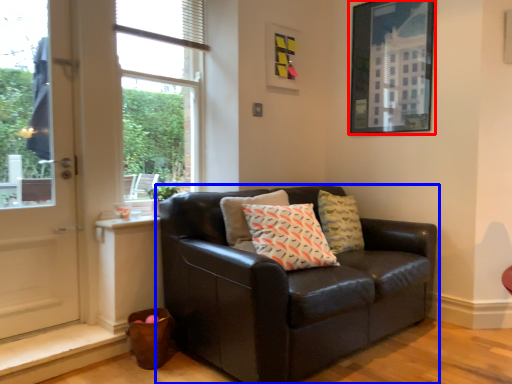
Question: Which object appears closest to the camera in this image, picture frame (highlighted by a red box) or studio couch (highlighted by a blue box)?

Choices:
 (A) picture frame
 (B) studio couch

Answer: (B)